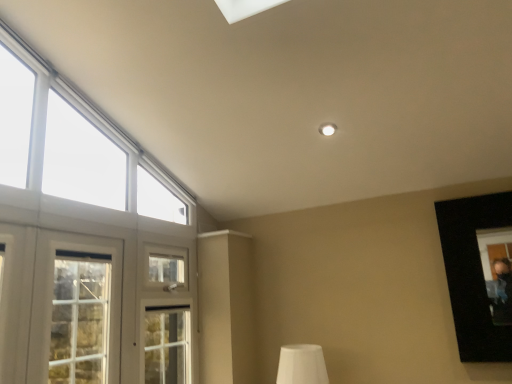
Question: From the image's perspective, does white wooden window at left, which ranks as the 1th window in bottom-to-top order, appear higher than white matte table lamp at lower center?

Choices:
 (A) no
 (B) yes

Answer: (B)

Question: Would you say white wooden window at left, which ranks as the 1th window in bottom-to-top order, is outside white matte table lamp at lower center?

Choices:
 (A) no
 (B) yes

Answer: (B)

Question: Is white wooden window at left, marked as the 2th window in a top-to-bottom arrangement, surrounding white matte table lamp at lower center?

Choices:
 (A) yes
 (B) no

Answer: (B)

Question: Can you confirm if white wooden window at left, which ranks as the 1th window in bottom-to-top order, is bigger than white matte table lamp at lower center?

Choices:
 (A) yes
 (B) no

Answer: (A)

Question: Is white wooden window at left, which ranks as the 1th window in bottom-to-top order, far away from white matte table lamp at lower center?

Choices:
 (A) no
 (B) yes

Answer: (B)

Question: Considering the positions of white matte table lamp at lower center and white glass window at upper left, the second window ordered from the bottom, in the image, is white matte table lamp at lower center bigger or smaller than white glass window at upper left, the second window ordered from the bottom,?

Choices:
 (A) big
 (B) small

Answer: (B)

Question: From the image's perspective, is white matte table lamp at lower center located above or below white glass window at upper left, the second window ordered from the bottom?

Choices:
 (A) below
 (B) above

Answer: (A)

Question: Is white matte table lamp at lower center inside the boundaries of white glass window at upper left, the second window ordered from the bottom, or outside?

Choices:
 (A) outside
 (B) inside

Answer: (A)

Question: Is point (284, 349) closer or farther from the camera than point (0, 211)?

Choices:
 (A) closer
 (B) farther

Answer: (B)

Question: Is white glass window at upper left, the first window positioned from the top, wider or thinner than white wooden window at left, which ranks as the 1th window in bottom-to-top order?

Choices:
 (A) wide
 (B) thin

Answer: (A)

Question: Is white glass window at upper left, the first window positioned from the top, inside the boundaries of white wooden window at left, marked as the 2th window in a top-to-bottom arrangement, or outside?

Choices:
 (A) inside
 (B) outside

Answer: (B)

Question: In terms of size, does white glass window at upper left, the second window ordered from the bottom, appear bigger or smaller than white wooden window at left, marked as the 2th window in a top-to-bottom arrangement?

Choices:
 (A) big
 (B) small

Answer: (A)

Question: In the image, is white glass window at upper left, the first window positioned from the top, positioned in front of or behind white wooden window at left, which ranks as the 1th window in bottom-to-top order?

Choices:
 (A) front
 (B) behind

Answer: (A)

Question: Would you say white glass window at upper left, the second window ordered from the bottom, is inside or outside white matte table lamp at lower center?

Choices:
 (A) outside
 (B) inside

Answer: (A)

Question: From the image's perspective, is white glass window at upper left, the second window ordered from the bottom, positioned above or below white matte table lamp at lower center?

Choices:
 (A) above
 (B) below

Answer: (A)